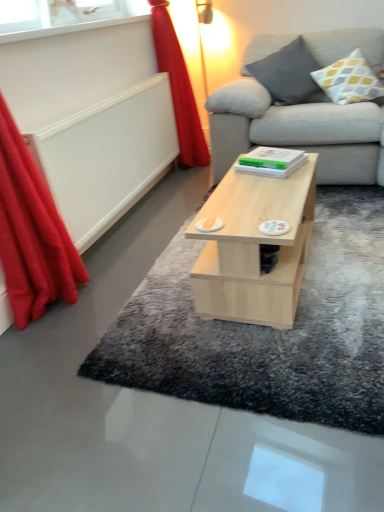
This screenshot has width=384, height=512. I want to click on vacant area that is situated to the right of red fabric curtain at left, placed as the first curtain when sorted from left to right, so click(111, 286).